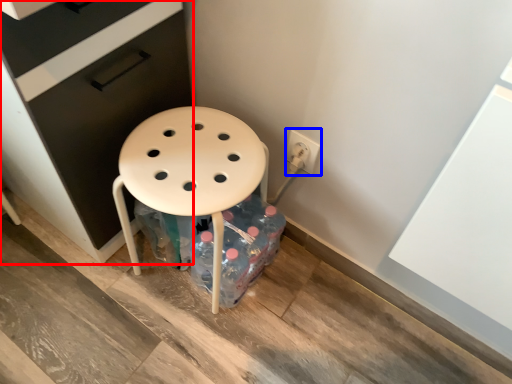
Question: Which object is closer to the camera taking this photo, file cabinet (highlighted by a red box) or electric outlet (highlighted by a blue box)?

Choices:
 (A) file cabinet
 (B) electric outlet

Answer: (A)